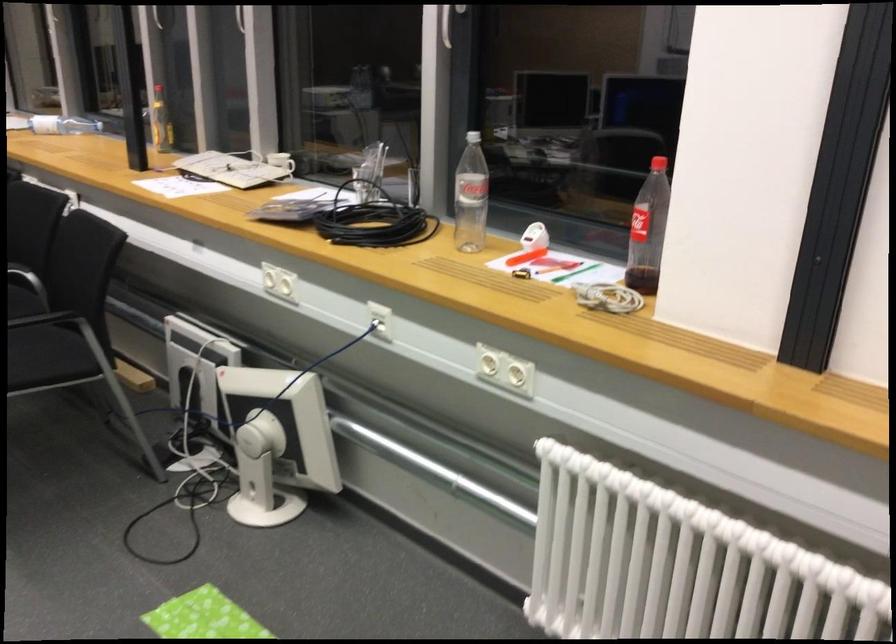
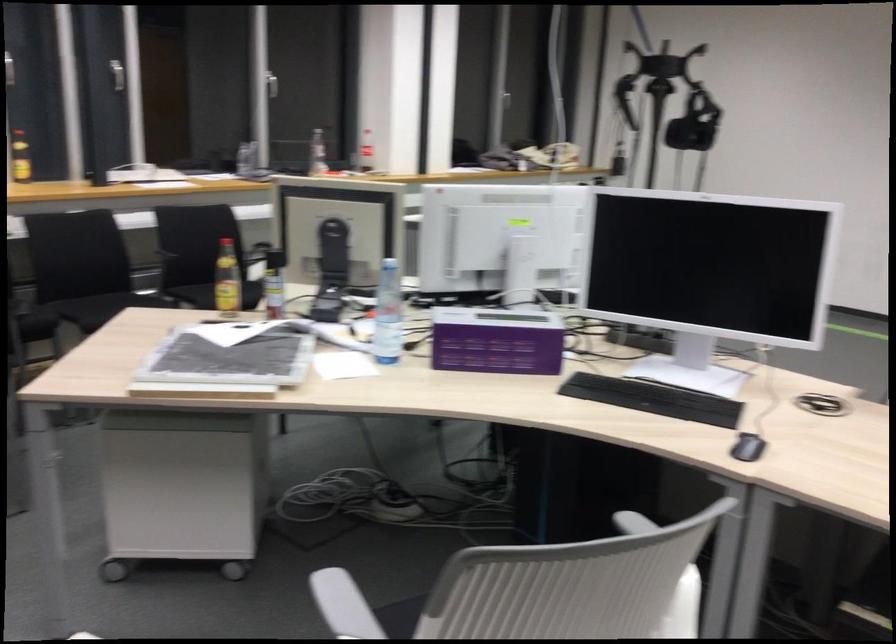
Question: I am providing you with two images of the same scene from different viewpoints. Which of the following objects are not visible in image2?

Choices:
 (A) white chair armrest
 (B) small white monitor
 (C) white bin lid
 (D) yellow-capped bottle

Answer: (B)